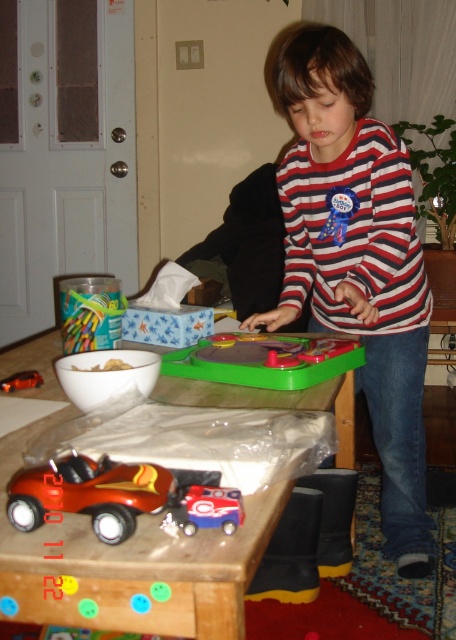
Does striped cotton shirt at center have a greater height compared to metallic red car at lower left?

Yes, striped cotton shirt at center is taller than metallic red car at lower left.

Can you confirm if striped cotton shirt at center is shorter than metallic red car at lower left?

No.

Locate an element on the screen. Image resolution: width=456 pixels, height=640 pixels. striped cotton shirt at center is located at coordinates (357, 260).

Who is more distant from viewer, (419, 401) or (212, 374)?

The point (419, 401) is more distant.

Is striped cotton shirt at center to the left of green plastic playset at center from the viewer's perspective?

In fact, striped cotton shirt at center is to the right of green plastic playset at center.

Describe the element at coordinates (357, 260) in the screenshot. I see `striped cotton shirt at center` at that location.

This screenshot has height=640, width=456. In order to click on striped cotton shirt at center in this screenshot , I will do `click(357, 260)`.

Is wooden table at center to the left of metallic red toy car at lower left from the viewer's perspective?

No, wooden table at center is not to the left of metallic red toy car at lower left.

Can you confirm if wooden table at center is positioned above metallic red toy car at lower left?

Actually, wooden table at center is below metallic red toy car at lower left.

Where is `wooden table at center`? The width and height of the screenshot is (456, 640). wooden table at center is located at coordinates (131, 563).

Where is `wooden table at center`? wooden table at center is located at coordinates (131, 563).